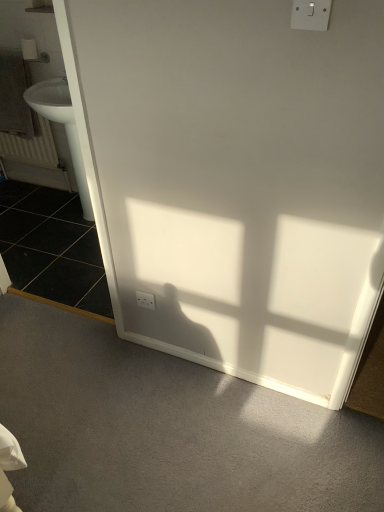
Where is `white matte toilet paper at upper left`? The image size is (384, 512). white matte toilet paper at upper left is located at coordinates (29, 49).

Describe the element at coordinates (310, 15) in the screenshot. I see `white plastic switch at upper right, the second electric outlet viewed from the back` at that location.

Measure the distance between point (306, 5) and camera.

Point (306, 5) and camera are 37.01 inches apart.

Locate an element on the screen. white matte toilet paper at upper left is located at coordinates (29, 49).

How far apart are white plastic electric outlet at lower left, acting as the 2th electric outlet starting from the front, and white matte toilet paper at upper left?

They are 5.74 feet apart.

Is white plastic electric outlet at lower left, the second electric outlet when ordered from top to bottom, to the left or to the right of white matte toilet paper at upper left in the image?

In the image, white plastic electric outlet at lower left, the second electric outlet when ordered from top to bottom, appears on the right side of white matte toilet paper at upper left.

From the image's perspective, does white plastic electric outlet at lower left, acting as the 2th electric outlet starting from the front, appear higher than white matte toilet paper at upper left?

Actually, white plastic electric outlet at lower left, acting as the 2th electric outlet starting from the front, appears below white matte toilet paper at upper left in the image.

What's the angular difference between white plastic electric outlet at lower left, which is counted as the first electric outlet, starting from the bottom, and white matte toilet paper at upper left's facing directions?

white plastic electric outlet at lower left, which is counted as the first electric outlet, starting from the bottom, and white matte toilet paper at upper left are facing 0.404 degrees away from each other.

From a real-world perspective, is white plastic electric outlet at lower left, which is the 1th electric outlet from back to front, positioned above or below gray textured towel at left?

From a real-world perspective, white plastic electric outlet at lower left, which is the 1th electric outlet from back to front, is physically below gray textured towel at left.

Is white plastic electric outlet at lower left, which is the 1th electric outlet from back to front, not inside gray textured towel at left?

Indeed, white plastic electric outlet at lower left, which is the 1th electric outlet from back to front, is completely outside gray textured towel at left.

Is white plastic electric outlet at lower left, the second electric outlet when ordered from top to bottom, next to gray textured towel at left and touching it?

No, white plastic electric outlet at lower left, the second electric outlet when ordered from top to bottom, is not in contact with gray textured towel at left.

Based on the photo, is white plastic electric outlet at lower left, the first electric outlet from the left, further to the viewer compared to gray textured towel at left?

That is False.

Does white plastic switch at upper right, the first electric outlet when ordered from front to back, have a greater width compared to black tile at left?

In fact, white plastic switch at upper right, the first electric outlet when ordered from front to back, might be narrower than black tile at left.

Looking at this image, does white plastic switch at upper right, which appears as the 2th electric outlet when viewed from the left, have a lesser height compared to black tile at left?

Incorrect, the height of white plastic switch at upper right, which appears as the 2th electric outlet when viewed from the left, does not fall short of that of black tile at left.

Does white plastic switch at upper right, the second electric outlet viewed from the back, turn towards black tile at left?

No, white plastic switch at upper right, the second electric outlet viewed from the back, is not aimed at black tile at left.

What's the angular difference between white plastic switch at upper right, the second electric outlet viewed from the back, and black tile at left's facing directions?

0.157 degrees.

Considering the positions of points (24, 114) and (44, 130), is point (24, 114) farther from camera compared to point (44, 130)?

That is False.

From a real-world perspective, is gray textured towel at left below white matte radiator at left?

No, from a real-world perspective, gray textured towel at left is not under white matte radiator at left.

Is gray textured towel at left spatially inside white matte radiator at left, or outside of it?

gray textured towel at left is spatially situated outside white matte radiator at left.

At what (x,y) coordinates should I click in order to perform the action: click on towel/napkin located on the left of white matte radiator at left. Please return your answer as a coordinate pair (x, y). The image size is (384, 512). Looking at the image, I should click on (14, 97).

Is gray textured towel at left not near black tile at left?

No, gray textured towel at left is not far from black tile at left.

Which of these two, gray textured towel at left or black tile at left, is smaller?

gray textured towel at left.

Which point is more forward, (296, 17) or (23, 149)?

The point (296, 17) is more forward.

Considering the relative sizes of white plastic switch at upper right, placed as the first electric outlet when sorted from top to bottom, and white matte radiator at left in the image provided, is white plastic switch at upper right, placed as the first electric outlet when sorted from top to bottom, taller than white matte radiator at left?

In fact, white plastic switch at upper right, placed as the first electric outlet when sorted from top to bottom, may be shorter than white matte radiator at left.

Are white plastic switch at upper right, acting as the first electric outlet starting from the right, and white matte radiator at left far apart?

Indeed, white plastic switch at upper right, acting as the first electric outlet starting from the right, is not near white matte radiator at left.

Would you say white plastic switch at upper right, the first electric outlet when ordered from front to back, is outside white matte radiator at left?

Yes, white plastic switch at upper right, the first electric outlet when ordered from front to back, is not within white matte radiator at left.

Would you say white plastic switch at upper right, the first electric outlet when ordered from front to back, is part of gray textured towel at left's contents?

No, gray textured towel at left does not contain white plastic switch at upper right, the first electric outlet when ordered from front to back.

Considering the relative sizes of gray textured towel at left and white plastic switch at upper right, the first electric outlet when ordered from front to back, in the image provided, is gray textured towel at left taller than white plastic switch at upper right, the first electric outlet when ordered from front to back,?

Yes, gray textured towel at left is taller than white plastic switch at upper right, the first electric outlet when ordered from front to back.

Measure the distance from gray textured towel at left to white plastic switch at upper right, acting as the first electric outlet starting from the right.

7.56 feet.

Is point (6, 70) closer to viewer compared to point (306, 16)?

That is False.

Identify the location of toilet paper on the left side of white plastic electric outlet at lower left, the first electric outlet from the left. (x=29, y=49).

Identify the location of the 1st electric outlet in front of the gray textured towel at left, counting from the anchor's position. The width and height of the screenshot is (384, 512). tap(146, 300).

Looking at the image, which one is located further to white matte toilet paper at upper left, white matte radiator at left or white plastic electric outlet at lower left, which is counted as the first electric outlet, starting from the bottom?

white plastic electric outlet at lower left, which is counted as the first electric outlet, starting from the bottom, is further to white matte toilet paper at upper left.

Considering their positions, is black tile at left positioned closer to white plastic electric outlet at lower left, the second electric outlet when ordered from top to bottom, than white matte radiator at left?

The object closer to white plastic electric outlet at lower left, the second electric outlet when ordered from top to bottom, is black tile at left.

Estimate the real-world distances between objects in this image. Which object is closer to white matte radiator at left, gray textured towel at left or white plastic electric outlet at lower left, which is counted as the first electric outlet, starting from the bottom?

gray textured towel at left is closer to white matte radiator at left.

When comparing their distances from black tile at left, does white plastic electric outlet at lower left, which is the 1th electric outlet from back to front, or white matte radiator at left seem closer?

Based on the image, white matte radiator at left appears to be nearer to black tile at left.

Considering their positions, is white plastic switch at upper right, acting as the first electric outlet starting from the right, positioned closer to black tile at left than white matte toilet paper at upper left?

white matte toilet paper at upper left.

Based on their spatial positions, is white plastic electric outlet at lower left, which is counted as the first electric outlet, starting from the bottom, or gray textured towel at left further from white matte toilet paper at upper left?

white plastic electric outlet at lower left, which is counted as the first electric outlet, starting from the bottom.

When comparing their distances from white matte toilet paper at upper left, does white matte radiator at left or gray textured towel at left seem further?

white matte radiator at left is positioned further to the anchor white matte toilet paper at upper left.

When comparing their distances from white plastic electric outlet at lower left, the first electric outlet from the left, does black tile at left or gray textured towel at left seem closer?

black tile at left is closer to white plastic electric outlet at lower left, the first electric outlet from the left.

At what (x,y) coordinates should I click in order to perform the action: click on tile positioned between white plastic switch at upper right, placed as the first electric outlet when sorted from top to bottom, and white matte toilet paper at upper left from near to far. Please return your answer as a coordinate pair (x, y). Looking at the image, I should click on (52, 248).

At what (x,y) coordinates should I click in order to perform the action: click on tile situated between white matte radiator at left and white plastic electric outlet at lower left, acting as the 2th electric outlet starting from the front, from left to right. Please return your answer as a coordinate pair (x, y). Looking at the image, I should click on (52, 248).

This screenshot has width=384, height=512. In order to click on tile between white plastic switch at upper right, acting as the first electric outlet starting from the right, and gray textured towel at left in the front-back direction in this screenshot , I will do point(52,248).

This screenshot has height=512, width=384. Identify the location of towel/napkin between white matte toilet paper at upper left and white matte radiator at left vertically. (14, 97).